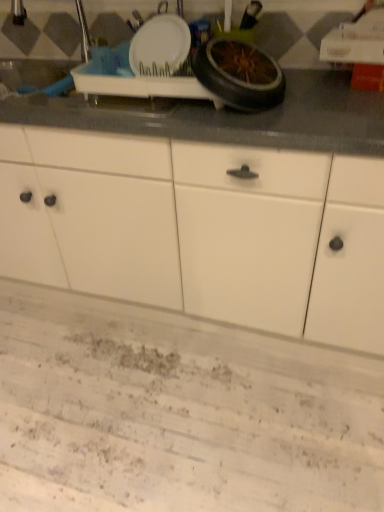
The height and width of the screenshot is (512, 384). In order to click on white matte cabinet at center in this screenshot , I will do `click(200, 229)`.

The image size is (384, 512). What do you see at coordinates (200, 229) in the screenshot?
I see `white matte cabinet at center` at bounding box center [200, 229].

Measure the distance between point (156, 298) and camera.

1.68 meters.

What do you see at coordinates (239, 74) in the screenshot? This screenshot has height=512, width=384. I see `black rubber wheel at upper center` at bounding box center [239, 74].

The height and width of the screenshot is (512, 384). Find the location of `black rubber wheel at upper center`. black rubber wheel at upper center is located at coordinates (239, 74).

Find the location of `white matte cabinet at center`. white matte cabinet at center is located at coordinates (200, 229).

Which object is positioned more to the right, black rubber wheel at upper center or white matte cabinet at center?

black rubber wheel at upper center is more to the right.

Based on the photo, which object is further away from the camera, black rubber wheel at upper center or white matte cabinet at center?

black rubber wheel at upper center is further from the camera.

Considering the points (231, 42) and (237, 238), which point is in front, point (231, 42) or point (237, 238)?

Positioned in front is point (231, 42).

From the image's perspective, is black rubber wheel at upper center positioned above or below white matte cabinet at center?

Clearly, from the image's perspective, black rubber wheel at upper center is above white matte cabinet at center.

From a real-world perspective, is black rubber wheel at upper center positioned above or below white matte cabinet at center?

Clearly, from a real-world perspective, black rubber wheel at upper center is above white matte cabinet at center.

Does black rubber wheel at upper center have a greater width compared to white matte cabinet at center?

No, black rubber wheel at upper center is not wider than white matte cabinet at center.

Considering the sizes of black rubber wheel at upper center and white matte cabinet at center in the image, is black rubber wheel at upper center taller or shorter than white matte cabinet at center?

black rubber wheel at upper center is shorter than white matte cabinet at center.

Is black rubber wheel at upper center bigger or smaller than white matte cabinet at center?

Clearly, black rubber wheel at upper center is smaller in size than white matte cabinet at center.

Could white matte cabinet at center be considered to be inside black rubber wheel at upper center?

That's incorrect, white matte cabinet at center is not inside black rubber wheel at upper center.

In the scene shown: Are black rubber wheel at upper center and white matte cabinet at center located far from each other?

No, black rubber wheel at upper center is in close proximity to white matte cabinet at center.

Is black rubber wheel at upper center turned away from white matte cabinet at center?

No, black rubber wheel at upper center's orientation is not away from white matte cabinet at center.

Where is `wheel behind the white matte cabinet at center`? wheel behind the white matte cabinet at center is located at coordinates (239, 74).

Between white matte cabinet at center and black rubber wheel at upper center, which one appears on the right side from the viewer's perspective?

black rubber wheel at upper center.

Between white matte cabinet at center and black rubber wheel at upper center, which one is positioned behind?

black rubber wheel at upper center is behind.

Which is further, (218, 179) or (204, 83)?

Positioned behind is point (218, 179).

From the image's perspective, is white matte cabinet at center located beneath black rubber wheel at upper center?

Correct, white matte cabinet at center appears lower than black rubber wheel at upper center in the image.

From a real-world perspective, which is physically below, white matte cabinet at center or black rubber wheel at upper center?

In real-world perspective, white matte cabinet at center is lower.

Can you confirm if white matte cabinet at center is thinner than black rubber wheel at upper center?

In fact, white matte cabinet at center might be wider than black rubber wheel at upper center.

Who is shorter, white matte cabinet at center or black rubber wheel at upper center?

With less height is black rubber wheel at upper center.

Is white matte cabinet at center smaller than black rubber wheel at upper center?

Incorrect, white matte cabinet at center is not smaller in size than black rubber wheel at upper center.

Do you think white matte cabinet at center is within black rubber wheel at upper center, or outside of it?

white matte cabinet at center is spatially situated outside black rubber wheel at upper center.

Based on the photo, does white matte cabinet at center touch black rubber wheel at upper center?

They are not placed beside each other.

Is black rubber wheel at upper center at the back of white matte cabinet at center?

No, white matte cabinet at center's orientation is not away from black rubber wheel at upper center.

How different are the orientations of white matte cabinet at center and black rubber wheel at upper center in degrees?

There is a 3.95-degree angle between the facing directions of white matte cabinet at center and black rubber wheel at upper center.

Where is `wheel behind the white matte cabinet at center`? This screenshot has height=512, width=384. wheel behind the white matte cabinet at center is located at coordinates (239, 74).

Identify the location of cabinetry in front of the black rubber wheel at upper center. The width and height of the screenshot is (384, 512). (200, 229).

Find the location of a particular element. Image resolution: width=384 pixels, height=512 pixels. wheel that is above the white matte cabinet at center (from a real-world perspective) is located at coordinates (239, 74).